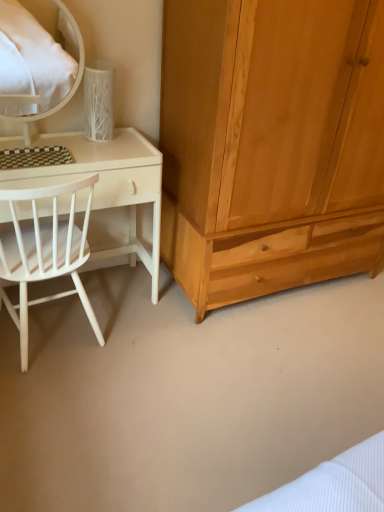
Measure the distance between point (5, 64) and camera.

They are 3.04 meters apart.

The width and height of the screenshot is (384, 512). Find the location of `white glossy mirror at upper left`. white glossy mirror at upper left is located at coordinates (34, 57).

What do you see at coordinates (271, 144) in the screenshot? I see `natural wood wardrobe at right` at bounding box center [271, 144].

Image resolution: width=384 pixels, height=512 pixels. Find the location of `white wood chair at left`. white wood chair at left is located at coordinates (45, 253).

Can you tell me how much natural wood wardrobe at right and white glossy mirror at upper left differ in facing direction?

natural wood wardrobe at right and white glossy mirror at upper left are facing 1.46 degrees away from each other.

Which point is more distant from viewer, [382,220] or [68,60]?

Positioned behind is point [68,60].

Who is shorter, natural wood wardrobe at right or white glossy mirror at upper left?

With less height is white glossy mirror at upper left.

Considering the positions of objects natural wood wardrobe at right and white glossy mirror at upper left in the image provided, who is behind, natural wood wardrobe at right or white glossy mirror at upper left?

white glossy mirror at upper left is behind.

Between white matte desk at left and white wood chair at left, which one is positioned in front?

white wood chair at left is closer to the camera.

What's the angular difference between white matte desk at left and white wood chair at left's facing directions?

The angular difference between white matte desk at left and white wood chair at left is 180 degrees.

Consider the image. Between white matte desk at left and white wood chair at left, which one has more height?

Standing taller between the two is white wood chair at left.

From a real-world perspective, is white matte desk at left on white wood chair at left?

No, from a real-world perspective, white matte desk at left is not on top of white wood chair at left.

From a real-world perspective, is white wood chair at left below white glossy mirror at upper left?

Correct, in the physical world, white wood chair at left is lower than white glossy mirror at upper left.

You are a GUI agent. You are given a task and a screenshot of the screen. Output one action in this format:
    pyautogui.click(x=<x>, y=<y>)
    Task: Click on the mirror above the white wood chair at left (from the image's perspective)
    
    Given the screenshot: What is the action you would take?
    pyautogui.click(x=34, y=57)

Considering the relative positions of white wood chair at left and white glossy mirror at upper left in the image provided, is white wood chair at left to the left of white glossy mirror at upper left from the viewer's perspective?

Correct, you'll find white wood chair at left to the left of white glossy mirror at upper left.

Can you tell me how much white wood chair at left and white glossy mirror at upper left differ in facing direction?

The angle between the facing direction of white wood chair at left and the facing direction of white glossy mirror at upper left is 179 degrees.

You are a GUI agent. You are given a task and a screenshot of the screen. Output one action in this format:
    pyautogui.click(x=<x>, y=<y>)
    Task: Click on the cabinetry that is above the white wood chair at left (from the image's perspective)
    This screenshot has height=512, width=384.
    Given the screenshot: What is the action you would take?
    pyautogui.click(x=271, y=144)

Which of these two, white wood chair at left or natural wood wardrobe at right, is wider?

natural wood wardrobe at right.

From a real-world perspective, who is located higher, white wood chair at left or natural wood wardrobe at right?

natural wood wardrobe at right, from a real-world perspective.

Could white wood chair at left be considered to be inside natural wood wardrobe at right?

No, white wood chair at left is not inside natural wood wardrobe at right.

Is natural wood wardrobe at right next to white wood chair at left?

They are not placed beside each other.

Is natural wood wardrobe at right bigger or smaller than white wood chair at left?

In the image, natural wood wardrobe at right appears to be larger than white wood chair at left.

From the image's perspective, is white glossy mirror at upper left located above or below natural wood wardrobe at right?

Based on their image positions, white glossy mirror at upper left is located above natural wood wardrobe at right.

Which object is more forward, white glossy mirror at upper left or natural wood wardrobe at right?

natural wood wardrobe at right is closer to the camera.

Is white glossy mirror at upper left to the right of natural wood wardrobe at right from the viewer's perspective?

No.

Which is in front, white glossy mirror at upper left or white matte desk at left?

Positioned in front is white glossy mirror at upper left.

Which of these two, white glossy mirror at upper left or white matte desk at left, is bigger?

white matte desk at left.

Is white glossy mirror at upper left not inside white matte desk at left?

Yes, white glossy mirror at upper left is outside of white matte desk at left.

From the picture: Does white glossy mirror at upper left turn towards white matte desk at left?

No, white glossy mirror at upper left is not turned towards white matte desk at left.

Locate an element on the screen. mirror above the natural wood wardrobe at right (from the image's perspective) is located at coordinates (34, 57).

Where is `chair below the white matte desk at left (from the image's perspective)`? This screenshot has height=512, width=384. chair below the white matte desk at left (from the image's perspective) is located at coordinates (45, 253).

When comparing their distances from white glossy mirror at upper left, does natural wood wardrobe at right or white matte desk at left seem further?

Based on the image, natural wood wardrobe at right appears to be further to white glossy mirror at upper left.

When comparing their distances from white matte desk at left, does white wood chair at left or white glossy mirror at upper left seem further?

The object further to white matte desk at left is white glossy mirror at upper left.

Looking at the image, which one is located closer to natural wood wardrobe at right, white glossy mirror at upper left or white matte desk at left?

Among the two, white matte desk at left is located nearer to natural wood wardrobe at right.

Considering their positions, is natural wood wardrobe at right positioned further to white wood chair at left than white matte desk at left?

Based on the image, natural wood wardrobe at right appears to be further to white wood chair at left.

From the image, which object appears to be farther from natural wood wardrobe at right, white matte desk at left or white glossy mirror at upper left?

white glossy mirror at upper left.

From the image, which object appears to be nearer to white wood chair at left, natural wood wardrobe at right or white glossy mirror at upper left?

Based on the image, natural wood wardrobe at right appears to be nearer to white wood chair at left.

Which object lies nearer to the anchor point white wood chair at left, white matte desk at left or natural wood wardrobe at right?

The object closer to white wood chair at left is white matte desk at left.

Looking at this image, from the image, which object appears to be nearer to natural wood wardrobe at right, white wood chair at left or white matte desk at left?

white matte desk at left lies closer to natural wood wardrobe at right than the other object.

Identify the location of desk between white glossy mirror at upper left and natural wood wardrobe at right from left to right. The width and height of the screenshot is (384, 512). (111, 192).

The width and height of the screenshot is (384, 512). I want to click on desk between white wood chair at left and natural wood wardrobe at right, so click(111, 192).

Find the location of `mirror between white wood chair at left and natural wood wardrobe at right`. mirror between white wood chair at left and natural wood wardrobe at right is located at coordinates (34, 57).

Locate an element on the screen. The width and height of the screenshot is (384, 512). desk between white glossy mirror at upper left and white wood chair at left vertically is located at coordinates (111, 192).